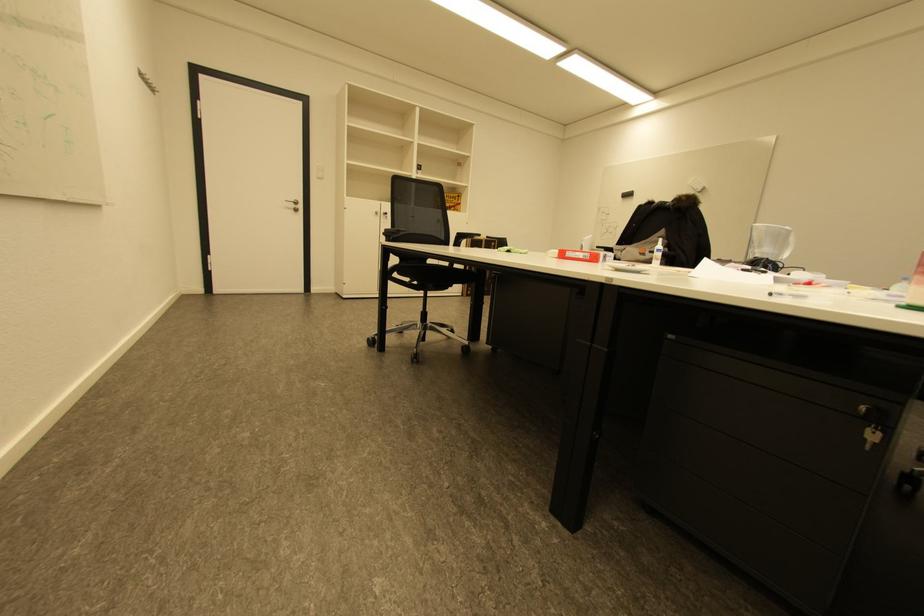
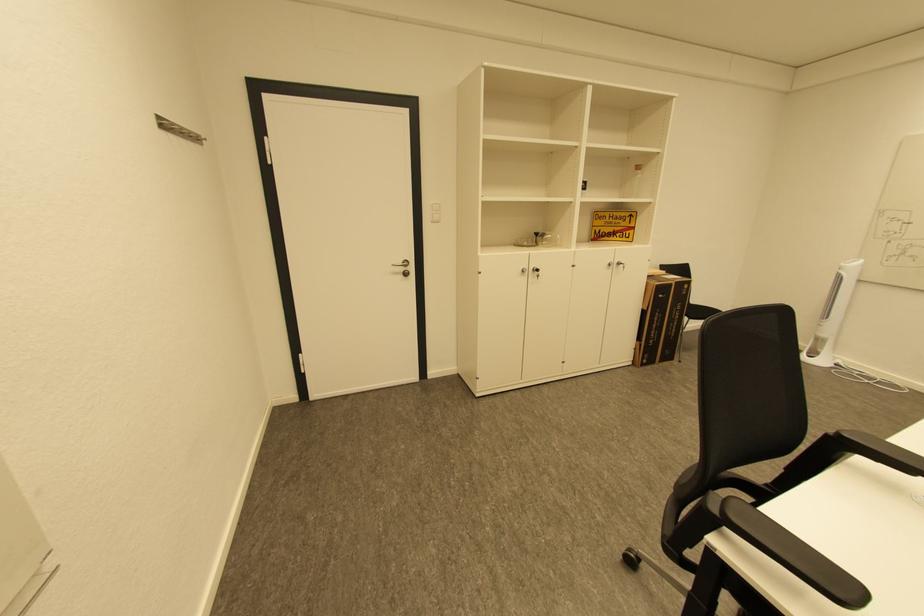
The point at (382, 214) is marked in the first image. Where is the corresponding point in the second image?

(529, 272)